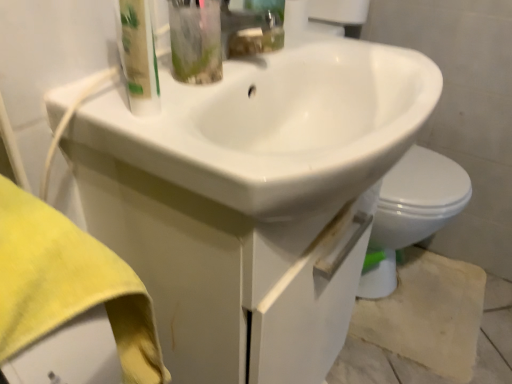
Question: Is white glossy sink at center shorter than translucent plastic bottle at upper left?

Choices:
 (A) yes
 (B) no

Answer: (A)

Question: From the image's perspective, does white glossy sink at center appear lower than translucent plastic bottle at upper left?

Choices:
 (A) yes
 (B) no

Answer: (A)

Question: From the image's perspective, is white glossy sink at center on translucent plastic bottle at upper left?

Choices:
 (A) no
 (B) yes

Answer: (A)

Question: Is translucent plastic bottle at upper left at the back of white glossy sink at center?

Choices:
 (A) yes
 (B) no

Answer: (B)

Question: From a real-world perspective, is white glossy sink at center under translucent plastic bottle at upper left?

Choices:
 (A) no
 (B) yes

Answer: (B)

Question: Is point (141, 97) positioned closer to the camera than point (484, 337)?

Choices:
 (A) closer
 (B) farther

Answer: (A)

Question: From a real-world perspective, is translucent plastic bottle at upper left positioned above or below beige textured concrete at lower right?

Choices:
 (A) above
 (B) below

Answer: (A)

Question: Is translucent plastic bottle at upper left in front of or behind beige textured concrete at lower right in the image?

Choices:
 (A) front
 (B) behind

Answer: (A)

Question: From the image's perspective, is translucent plastic bottle at upper left located above or below beige textured concrete at lower right?

Choices:
 (A) above
 (B) below

Answer: (A)

Question: Looking at their shapes, would you say beige textured concrete at lower right is wider or thinner than white glossy sink at center?

Choices:
 (A) thin
 (B) wide

Answer: (A)

Question: Relative to white glossy sink at center, is beige textured concrete at lower right in front or behind?

Choices:
 (A) behind
 (B) front

Answer: (A)

Question: From the image's perspective, is beige textured concrete at lower right located above or below white glossy sink at center?

Choices:
 (A) below
 (B) above

Answer: (A)

Question: In terms of size, does beige textured concrete at lower right appear bigger or smaller than white glossy sink at center?

Choices:
 (A) big
 (B) small

Answer: (B)

Question: Visually, is white glossy sink at center positioned to the left or to the right of white glossy drawer at center?

Choices:
 (A) left
 (B) right

Answer: (B)

Question: From the image's perspective, is white glossy sink at center positioned above or below white glossy drawer at center?

Choices:
 (A) below
 (B) above

Answer: (B)